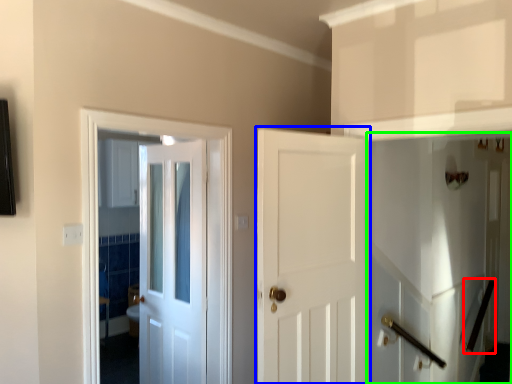
Question: Considering the real-world distances, which object is closest to door handle (highlighted by a red box)? door (highlighted by a blue box) or elevator (highlighted by a green box).

Choices:
 (A) door
 (B) elevator

Answer: (B)